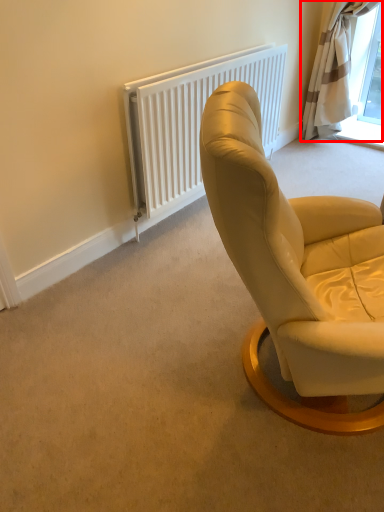
Question: In this image, where is curtain (annotated by the red box) located relative to radiator?

Choices:
 (A) left
 (B) right

Answer: (B)